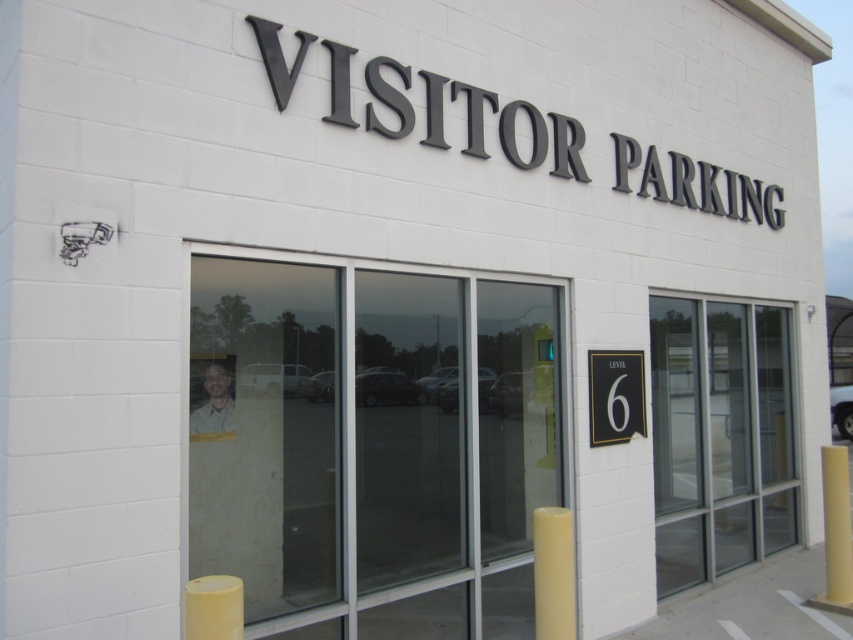
You are standing in front of the building and want to take a photo of the two points marked on the glass doors. Which point, point (743, 481) or point (601, 406), will appear closer to the camera in your photo?

Point (743, 481) is further to the camera than point (601, 406), so in the photo, point (601, 406) will appear closer to the camera.